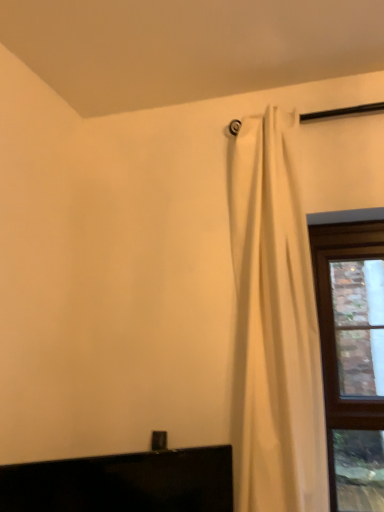
What do you see at coordinates (123, 483) in the screenshot?
I see `black glossy tv at lower left` at bounding box center [123, 483].

Measure the distance between black glossy tv at lower left and camera.

black glossy tv at lower left is 3.63 feet away from camera.

Where is `black glossy tv at lower left`? black glossy tv at lower left is located at coordinates (123, 483).

The image size is (384, 512). I want to click on black glossy tv at lower left, so click(x=123, y=483).